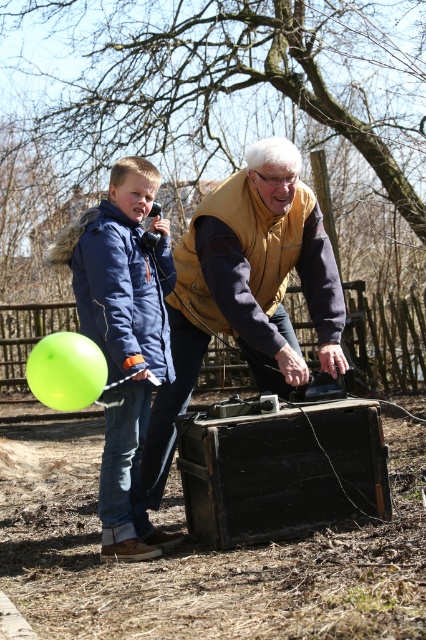
Does matte yellow vest at center appear under green rubber balloon at lower left?

No.

Can you confirm if matte yellow vest at center is positioned to the left of green rubber balloon at lower left?

Incorrect, matte yellow vest at center is not on the left side of green rubber balloon at lower left.

You are a GUI agent. You are given a task and a screenshot of the screen. Output one action in this format:
    pyautogui.click(x=<x>, y=<y>)
    Task: Click on the matte yellow vest at center
    The image size is (426, 640).
    Given the screenshot: What is the action you would take?
    pyautogui.click(x=247, y=291)

Which is above, matte yellow vest at center or matte blue jacket at left?

Positioned higher is matte yellow vest at center.

Does matte yellow vest at center have a greater height compared to matte blue jacket at left?

No.

Who is more forward, (172,442) or (112,522)?

Positioned in front is point (112,522).

You are a GUI agent. You are given a task and a screenshot of the screen. Output one action in this format:
    pyautogui.click(x=<x>, y=<y>)
    Task: Click on the matte yellow vest at center
    Image resolution: width=426 pixels, height=640 pixels.
    Given the screenshot: What is the action you would take?
    pyautogui.click(x=247, y=291)

Who is positioned more to the right, matte blue jacket at left or green rubber balloon at lower left?

matte blue jacket at left

Based on the photo, is matte blue jacket at left below green rubber balloon at lower left?

No, matte blue jacket at left is not below green rubber balloon at lower left.

I want to click on matte blue jacket at left, so click(123, 339).

The image size is (426, 640). I want to click on matte blue jacket at left, so [x=123, y=339].